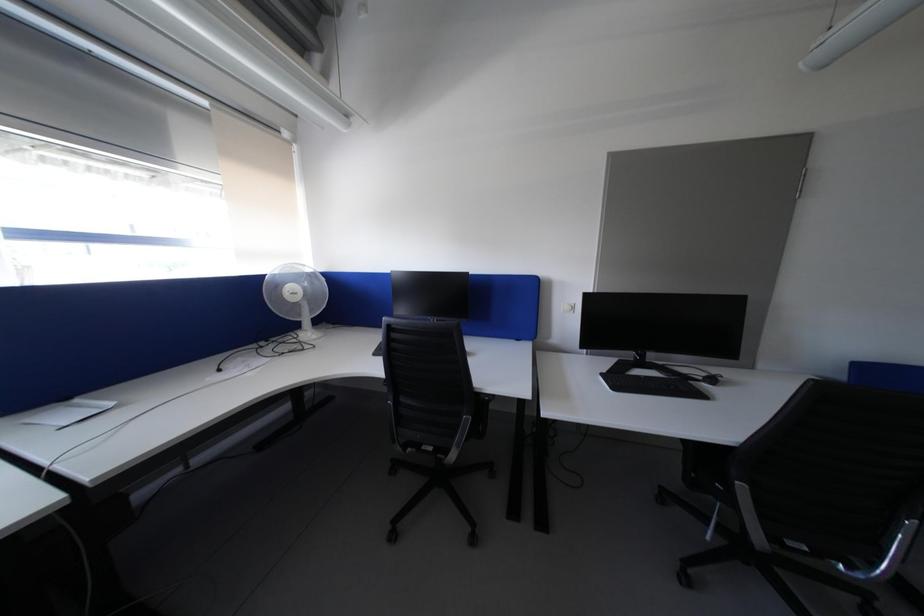
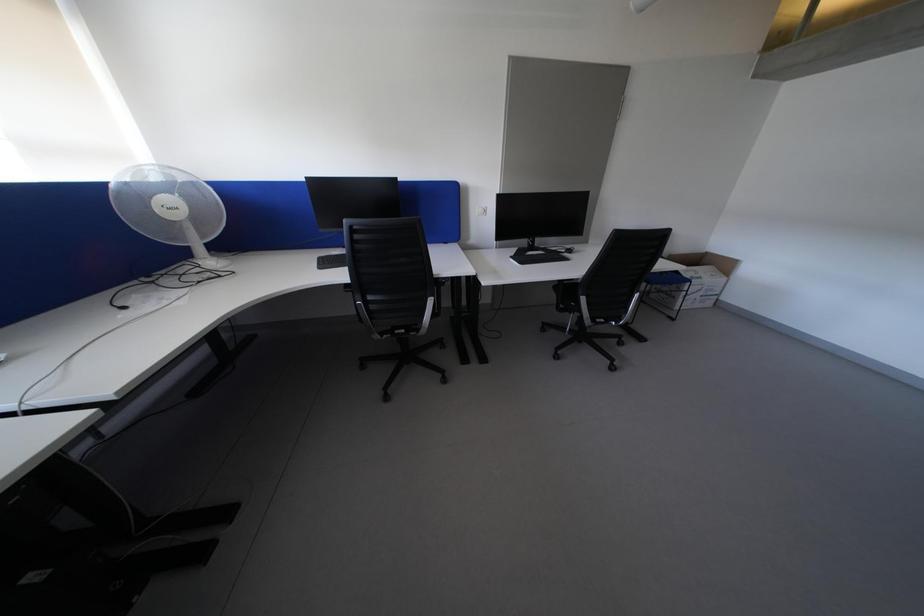
First-person continuous shooting, in which direction is the camera rotating?

The camera rotated toward right-down.